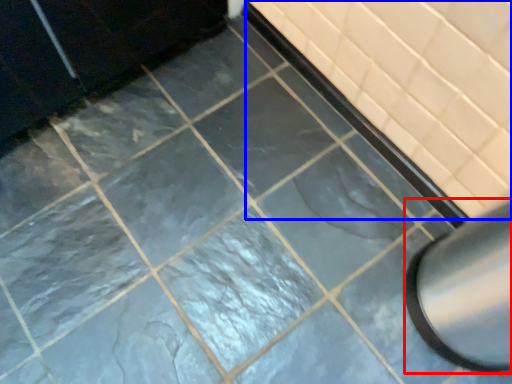
Question: Which point is further to the camera, exhaust hood (highlighted by a red box) or bath (highlighted by a blue box)?

Choices:
 (A) exhaust hood
 (B) bath

Answer: (B)